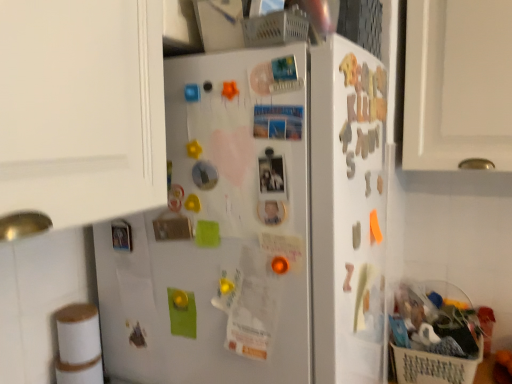
This screenshot has width=512, height=384. What are the coordinates of `orange matte letter s at upper right, positioned as the 4th magnet in right-to-left order` in the screenshot? It's located at (350, 164).

Describe the element at coordinates (204, 175) in the screenshot. I see `metallic silver magnet at center, the 9th magnet from the right` at that location.

The width and height of the screenshot is (512, 384). Identify the location of metallic silver photo frame at left, which appears as the first magnet when viewed from the left. (121, 235).

The width and height of the screenshot is (512, 384). What do you see at coordinates (356, 235) in the screenshot?
I see `matte silver magnet at right, the 11th magnet positioned from the left` at bounding box center [356, 235].

The height and width of the screenshot is (384, 512). In order to click on matte silver magnet at right, which ranks as the 3th magnet in right-to-left order in this screenshot , I will do `click(356, 235)`.

What is the approximate width of orange matte magnet at upper right, the 13th magnet from the left?

It is 0.39 inches.

The height and width of the screenshot is (384, 512). Identify the location of orange glossy magnet at center, arranged as the seventh magnet when viewed from the right. (280, 265).

The height and width of the screenshot is (384, 512). In order to click on the 5th magnet below when counting from the orange matte magnet at upper right, which is the 1th magnet from right to left (from the image's perspective) in this screenshot , I will do `click(280, 265)`.

Would you say orange glossy magnet at center, arranged as the seventh magnet when viewed from the right, is to the left or to the right of orange matte magnet at upper right, the 13th magnet from the left, in the picture?

orange glossy magnet at center, arranged as the seventh magnet when viewed from the right, is to the left of orange matte magnet at upper right, the 13th magnet from the left.

What's the angular difference between orange glossy magnet at center, which is the 7th magnet in left-to-right order, and orange matte magnet at upper right, which is the 1th magnet from right to left,'s facing directions?

91.5 degrees.

Measure the distance from orange glossy magnet at center, which is the 7th magnet in left-to-right order, to orange matte magnet at upper right, which is the 1th magnet from right to left.

orange glossy magnet at center, which is the 7th magnet in left-to-right order, and orange matte magnet at upper right, which is the 1th magnet from right to left, are 15.12 inches apart from each other.

From the image's perspective, is orange matte magnet at upper right, the 13th magnet from the left, on top of metallic silver button at center, the first button viewed from the top?

No, from the image's perspective, orange matte magnet at upper right, the 13th magnet from the left, is not on top of metallic silver button at center, the first button viewed from the top.

Between point (378, 175) and point (268, 180), which one is positioned in front?

The point (268, 180) is closer.

This screenshot has width=512, height=384. Identify the location of button that is the 1st one when counting leftward from the orange matte magnet at upper right, the 13th magnet from the left. (272, 176).

Is orange matte magnet at upper right, the 13th magnet from the left, positioned behind metallic silver button at center, the first button viewed from the top?

Yes, the depth of orange matte magnet at upper right, the 13th magnet from the left, is greater than that of metallic silver button at center, the first button viewed from the top.

Would you say yellow rubber at upper center, arranged as the 4th magnet when viewed from the left, is to the left or to the right of orange matte letter s at upper right, positioned as the 4th magnet in right-to-left order, in the picture?

Based on their positions, yellow rubber at upper center, arranged as the 4th magnet when viewed from the left, is located to the left of orange matte letter s at upper right, positioned as the 4th magnet in right-to-left order.

Is yellow rubber at upper center, arranged as the 4th magnet when viewed from the left, facing away from orange matte letter s at upper right, which ranks as the tenth magnet in left-to-right order?

No, yellow rubber at upper center, arranged as the 4th magnet when viewed from the left, is not facing the opposite direction of orange matte letter s at upper right, which ranks as the tenth magnet in left-to-right order.

From a real-world perspective, which object stands above the other?

From a 3D spatial view, yellow rubber at upper center, arranged as the 4th magnet when viewed from the left, is above.

From the image's perspective, between yellow rubber at upper center, arranged as the 4th magnet when viewed from the left, and orange matte letter s at upper right, which ranks as the tenth magnet in left-to-right order, which one is located above?

yellow rubber at upper center, arranged as the 4th magnet when viewed from the left, from the image's perspective.

Considering the sizes of orange matte magnet at upper right, which is the 1th magnet from right to left, and yellow rubber at upper center, arranged as the 4th magnet when viewed from the left, in the image, is orange matte magnet at upper right, which is the 1th magnet from right to left, wider or thinner than yellow rubber at upper center, arranged as the 4th magnet when viewed from the left,?

orange matte magnet at upper right, which is the 1th magnet from right to left, is thinner than yellow rubber at upper center, arranged as the 4th magnet when viewed from the left.

Does orange matte magnet at upper right, which is the 1th magnet from right to left, have a smaller size compared to yellow rubber at upper center, which is the tenth magnet from right to left?

No.

Considering their positions, is orange matte magnet at upper right, which is the 1th magnet from right to left, located in front of or behind yellow rubber at upper center, arranged as the 4th magnet when viewed from the left?

Clearly, orange matte magnet at upper right, which is the 1th magnet from right to left, is behind yellow rubber at upper center, arranged as the 4th magnet when viewed from the left.

Is orange matte magnet at upper right, which is the 1th magnet from right to left, directly adjacent to yellow rubber at upper center, arranged as the 4th magnet when viewed from the left?

There is a gap between orange matte magnet at upper right, which is the 1th magnet from right to left, and yellow rubber at upper center, arranged as the 4th magnet when viewed from the left.

Which of these two, yellow rubber at upper center, arranged as the 4th magnet when viewed from the left, or orange matte magnet at upper right, which is the 1th magnet from right to left, stands shorter?

yellow rubber at upper center, arranged as the 4th magnet when viewed from the left, is shorter.

Considering the positions of points (193, 146) and (378, 180), is point (193, 146) closer to camera compared to point (378, 180)?

That is True.

Is yellow rubber at upper center, arranged as the 4th magnet when viewed from the left, next to orange matte magnet at upper right, which is the 1th magnet from right to left?

No, yellow rubber at upper center, arranged as the 4th magnet when viewed from the left, is not making contact with orange matte magnet at upper right, which is the 1th magnet from right to left.

How many degrees apart are the facing directions of yellow rubber at upper center, arranged as the 4th magnet when viewed from the left, and orange matte magnet at upper right, which is the 1th magnet from right to left?

The angular difference between yellow rubber at upper center, arranged as the 4th magnet when viewed from the left, and orange matte magnet at upper right, which is the 1th magnet from right to left, is 90.4 degrees.

Which of these two, metallic silver button at center, the first button viewed from the top, or bamboo toilet paper at lower left, is thinner?

With smaller width is metallic silver button at center, the first button viewed from the top.

Is point (271, 172) closer to viewer compared to point (79, 311)?

Yes.

Could you measure the distance between metallic silver button at center, the first button viewed from the top, and bamboo toilet paper at lower left?

metallic silver button at center, the first button viewed from the top, is 52.55 centimeters away from bamboo toilet paper at lower left.

Does metallic silver button at center, the first button viewed from the top, turn towards bamboo toilet paper at lower left?

No.

Is metallic silver photo frame at left, which appears as the first magnet when viewed from the left, bigger than white matte refrigerator at center?

Actually, metallic silver photo frame at left, which appears as the first magnet when viewed from the left, might be smaller than white matte refrigerator at center.

Can you tell me how much metallic silver photo frame at left, which appears as the first magnet when viewed from the left, and white matte refrigerator at center differ in facing direction?

metallic silver photo frame at left, which appears as the first magnet when viewed from the left, and white matte refrigerator at center are facing 91.6 degrees away from each other.

From a real-world perspective, count 2nd magnets upward from the white matte refrigerator at center and point to it. Please provide its 2D coordinates.

[(121, 235)]

Is metallic silver photo frame at left, which ranks as the thirteenth magnet in right-to-left order, directly adjacent to white matte refrigerator at center?

No, metallic silver photo frame at left, which ranks as the thirteenth magnet in right-to-left order, is not in contact with white matte refrigerator at center.

At what (x,y) coordinates should I click in order to perform the action: click on the 4th magnet positioned above the orange glossy magnet at center, arranged as the seventh magnet when viewed from the right (from a real-world perspective). Please return your answer as a coordinate pair (x, y). This screenshot has width=512, height=384. Looking at the image, I should click on (380, 184).

This screenshot has height=384, width=512. I want to click on the 1st magnet below the metallic silver button at center, the first button viewed from the top (from the image's perspective), so click(380, 184).

Which object lies further to the anchor point metallic silver button at center, positioned as the 2th button in bottom-to-top order, metallic silver magnet at upper right, positioned as the fifth magnet in right-to-left order, or plastic shopping basket at lower right?

plastic shopping basket at lower right is further to metallic silver button at center, positioned as the 2th button in bottom-to-top order.

From the picture: When comparing their distances from bamboo toilet paper at lower left, does white matte refrigerator at center or gold metallic magnet at upper right, the sixth magnet when ordered from right to left, seem further?

gold metallic magnet at upper right, the sixth magnet when ordered from right to left, is further to bamboo toilet paper at lower left.

Estimate the real-world distances between objects in this image. Which object is closer to bamboo toilet paper at lower left, orange matte letter s at upper right, positioned as the 4th magnet in right-to-left order, or white matte refrigerator at center?

white matte refrigerator at center is positioned closer to the anchor bamboo toilet paper at lower left.

When comparing their distances from metallic silver photo frame at left, which appears as the first magnet when viewed from the left, does metallic silver magnet at center, the 2th magnet positioned from the left, or metallic silver magnet at center, the 9th magnet from the right, seem further?

metallic silver magnet at center, the 9th magnet from the right, is further to metallic silver photo frame at left, which appears as the first magnet when viewed from the left.

Which object lies further to the anchor point orange glossy magnet at center, which is the 7th magnet in left-to-right order, orange matte magnet at right, which ranks as the 2th magnet in right-to-left order, or orange matte magnet at upper right, the 13th magnet from the left?

Among the two, orange matte magnet at upper right, the 13th magnet from the left, is located further to orange glossy magnet at center, which is the 7th magnet in left-to-right order.

Based on their spatial positions, is blue plastic magnet at upper center, which is the third magnet from left to right, or orange matte magnet at upper right, the 13th magnet from the left, further from orange glossy magnet at center, arranged as the seventh magnet when viewed from the right?

The object further to orange glossy magnet at center, arranged as the seventh magnet when viewed from the right, is orange matte magnet at upper right, the 13th magnet from the left.

Based on their spatial positions, is orange matte magnet at right, marked as the 12th magnet in a left-to-right arrangement, or orange glossy magnet at center, which is the 7th magnet in left-to-right order, further from gold metallic magnet at upper right, the sixth magnet when ordered from right to left?

The object further to gold metallic magnet at upper right, the sixth magnet when ordered from right to left, is orange glossy magnet at center, which is the 7th magnet in left-to-right order.

Which object lies nearer to the anchor point orange matte letter s at upper right, positioned as the 4th magnet in right-to-left order, metallic silver photo frame at left, which appears as the first magnet when viewed from the left, or orange matte magnet at right, marked as the 12th magnet in a left-to-right arrangement?

orange matte magnet at right, marked as the 12th magnet in a left-to-right arrangement.

Image resolution: width=512 pixels, height=384 pixels. Identify the location of refrigerator located between bamboo toilet paper at lower left and matte plastic photo at center, which appears as the second button when viewed from the top, in the left-right direction. click(x=258, y=229).

The width and height of the screenshot is (512, 384). I want to click on refrigerator between metallic silver magnet at center, acting as the 12th magnet starting from the right, and orange glossy magnet at center, which is the 7th magnet in left-to-right order, in the horizontal direction, so click(x=258, y=229).

Locate an element on the screen. button located between matte plastic photo at center, which appears as the second button when viewed from the top, and orange matte magnet at right, which ranks as the 2th magnet in right-to-left order, in the left-right direction is located at coordinates (272, 176).

Where is `button between matte plastic photo at center, which appears as the second button when viewed from the top, and orange matte magnet at upper right, the 13th magnet from the left, in the horizontal direction`? Image resolution: width=512 pixels, height=384 pixels. button between matte plastic photo at center, which appears as the second button when viewed from the top, and orange matte magnet at upper right, the 13th magnet from the left, in the horizontal direction is located at coordinates (272, 176).